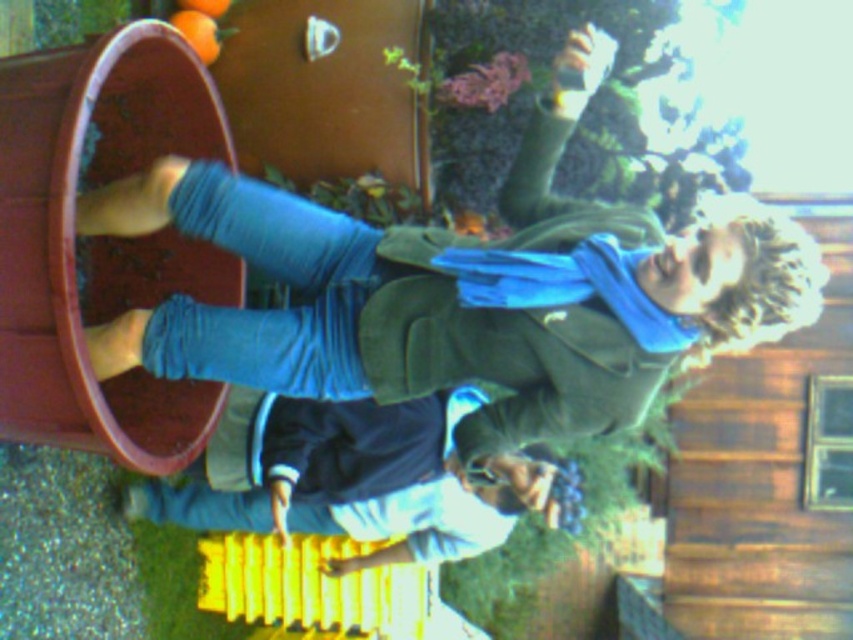
You are a photographer trying to capture the blue cotton scarf at upper right in the image. According to the coordinates provided, where exactly should you focus your camera lens to ensure the scarf is centered in the frame?

To center the blue cotton scarf at upper right in the frame, focus your camera lens at the coordinates point (467,289).

You are a photographer trying to capture a photo of the dark blue jeans at lower center and the orange matte at upper center. Which object should you focus on first if you want to ensure both are in focus without adjusting your camera settings? Explain your reasoning based on their positions.

The dark blue jeans at lower center is taller than the orange matte at upper center. To ensure both are in focus, you should focus on the dark blue jeans at lower center first because it is larger and closer to the camera, making it easier to achieve sharpness. Adjusting focus on the closer, larger object first helps maintain clarity for both subjects.